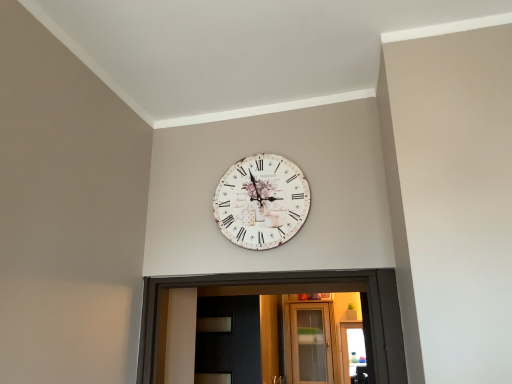
The width and height of the screenshot is (512, 384). Identify the location of vintage paper clock at center. (262, 201).

The height and width of the screenshot is (384, 512). What do you see at coordinates (262, 201) in the screenshot?
I see `vintage paper clock at center` at bounding box center [262, 201].

Measure the distance between point [223,203] and camera.

Point [223,203] is 4.78 feet from camera.

The height and width of the screenshot is (384, 512). Describe the element at coordinates (310, 343) in the screenshot. I see `clear glass door at center` at that location.

What is the approximate height of clear glass door at center?

clear glass door at center is 28.02 inches in height.

Identify the location of clear glass door at center. (310, 343).

Locate an element on the screen. This screenshot has width=512, height=384. vintage paper clock at center is located at coordinates (262, 201).

Visually, is vintage paper clock at center positioned to the left or to the right of clear glass door at center?

In the image, vintage paper clock at center appears on the left side of clear glass door at center.

Is the depth of vintage paper clock at center greater than that of clear glass door at center?

No, vintage paper clock at center is in front of clear glass door at center.

Is point (295, 209) more distant than point (297, 313)?

No, it is not.

From the image's perspective, relative to clear glass door at center, is vintage paper clock at center above or below?

vintage paper clock at center is above clear glass door at center.

From a real-world perspective, who is located higher, vintage paper clock at center or clear glass door at center?

vintage paper clock at center.

Which object is wider, vintage paper clock at center or clear glass door at center?

clear glass door at center.

Considering the sizes of objects vintage paper clock at center and clear glass door at center in the image provided, who is taller, vintage paper clock at center or clear glass door at center?

Standing taller between the two is clear glass door at center.

Considering the sizes of objects vintage paper clock at center and clear glass door at center in the image provided, who is smaller, vintage paper clock at center or clear glass door at center?

Smaller between the two is vintage paper clock at center.

Is vintage paper clock at center positioned beyond the bounds of clear glass door at center?

vintage paper clock at center lies outside clear glass door at center's area.

Would you consider vintage paper clock at center to be distant from clear glass door at center?

Yes, vintage paper clock at center is far from clear glass door at center.

Is vintage paper clock at center facing away from clear glass door at center?

Yes, vintage paper clock at center is facing away from clear glass door at center.

Image resolution: width=512 pixels, height=384 pixels. I want to click on wall clock that appears in front of the clear glass door at center, so click(262, 201).

Is clear glass door at center to the right of vintage paper clock at center from the viewer's perspective?

Yes.

Which object is further away from the camera, clear glass door at center or vintage paper clock at center?

clear glass door at center is further away from the camera.

Considering the positions of point (303, 325) and point (289, 213), is point (303, 325) closer or farther from the camera than point (289, 213)?

Point (303, 325).

From the picture: From the image's perspective, is clear glass door at center positioned above or below vintage paper clock at center?

From the image's perspective, clear glass door at center appears below vintage paper clock at center.

Based on the photo, from a real-world perspective, is clear glass door at center under vintage paper clock at center?

Yes.

Considering the relative sizes of clear glass door at center and vintage paper clock at center in the image provided, is clear glass door at center thinner than vintage paper clock at center?

Incorrect, the width of clear glass door at center is not less than that of vintage paper clock at center.

Between clear glass door at center and vintage paper clock at center, which one has more height?

clear glass door at center is taller.

Considering the sizes of clear glass door at center and vintage paper clock at center in the image, is clear glass door at center bigger or smaller than vintage paper clock at center?

clear glass door at center is bigger than vintage paper clock at center.

Choose the correct answer: Is clear glass door at center inside vintage paper clock at center or outside it?

clear glass door at center is spatially situated outside vintage paper clock at center.

Is clear glass door at center with vintage paper clock at center?

No, clear glass door at center is not making contact with vintage paper clock at center.

Is clear glass door at center oriented away from vintage paper clock at center?

clear glass door at center does not have its back to vintage paper clock at center.

The height and width of the screenshot is (384, 512). I want to click on glass door lying below the vintage paper clock at center (from the image's perspective), so click(310, 343).

Locate an element on the screen. This screenshot has width=512, height=384. glass door located below the vintage paper clock at center (from the image's perspective) is located at coordinates click(310, 343).

Identify the location of glass door behind the vintage paper clock at center. (310, 343).